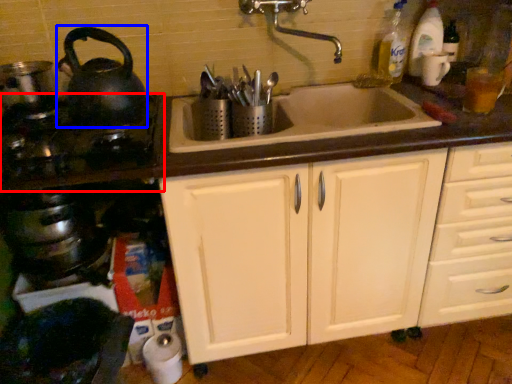
Question: Which object appears farthest to the camera in this image, gas stove (highlighted by a red box) or tea pot (highlighted by a blue box)?

Choices:
 (A) gas stove
 (B) tea pot

Answer: (B)